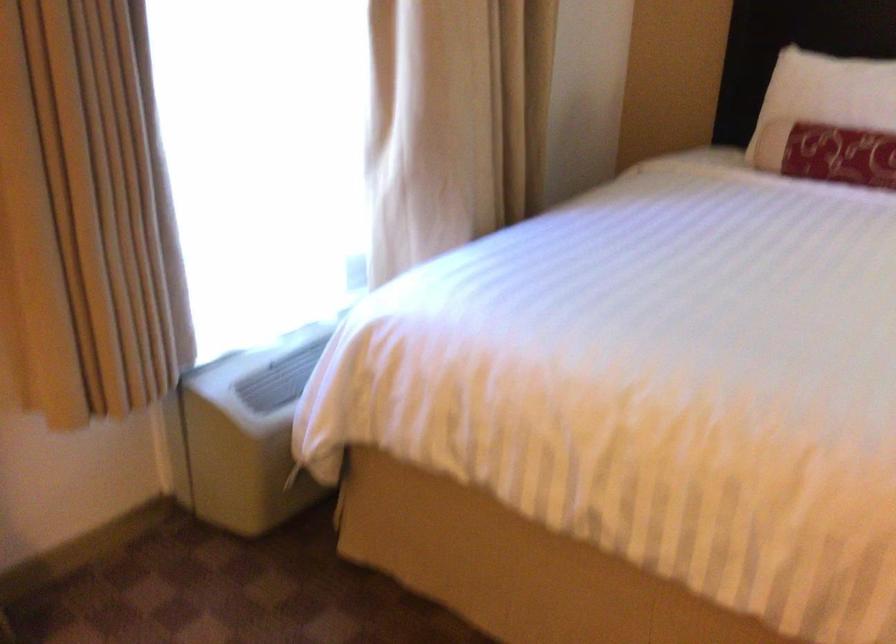
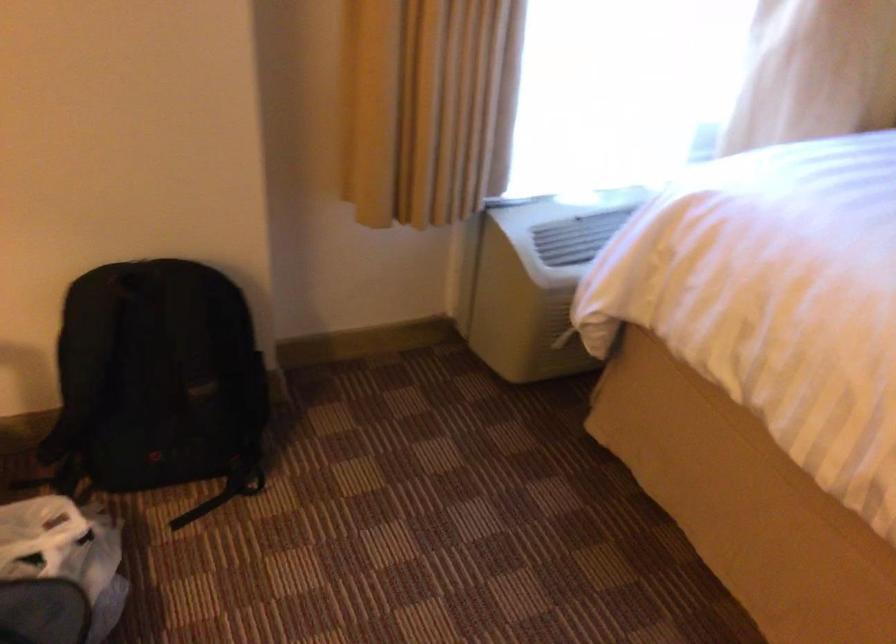
Question: The first image is from the beginning of the video and the second image is from the end. How did the camera likely rotate when shooting the video?

Choices:
 (A) Left
 (B) Right
 (C) Up
 (D) Down

Answer: (A)